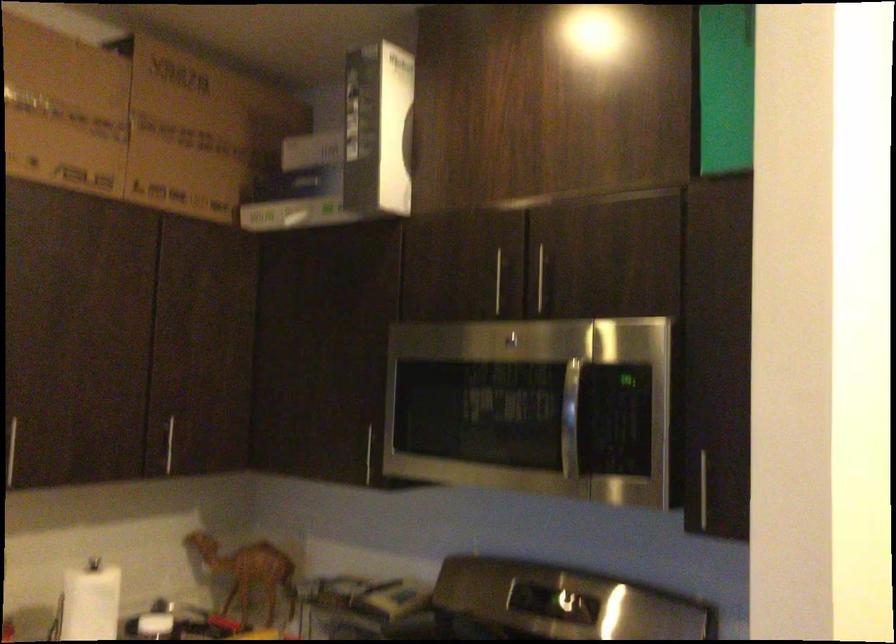
Find the location of a particular element. The width and height of the screenshot is (896, 644). large cardboard box is located at coordinates (200, 131).